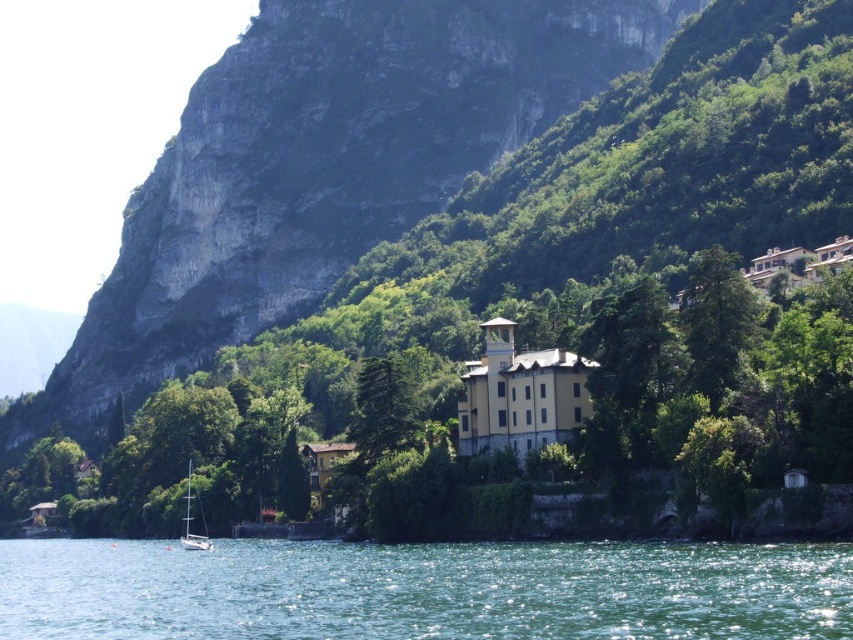
Question: Is green leafy tree at center smaller than white glossy sailboat at lower left?

Choices:
 (A) no
 (B) yes

Answer: (A)

Question: Does rocky cliff at upper left appear under white glossy sailboat at lower left?

Choices:
 (A) yes
 (B) no

Answer: (B)

Question: Which is nearer to the white glossy sailboat at lower left?

Choices:
 (A) green leafy tree at center
 (B) green liquid water at lower center
 (C) rocky cliff at upper left

Answer: (B)

Question: Does rocky cliff at upper left have a lesser width compared to green liquid water at lower center?

Choices:
 (A) yes
 (B) no

Answer: (B)

Question: Which of the following is the farthest from the observer?

Choices:
 (A) rocky cliff at upper left
 (B) white glossy sailboat at lower left

Answer: (A)

Question: Which object appears farthest from the camera in this image?

Choices:
 (A) green liquid water at lower center
 (B) rocky cliff at upper left
 (C) white glossy sailboat at lower left

Answer: (B)